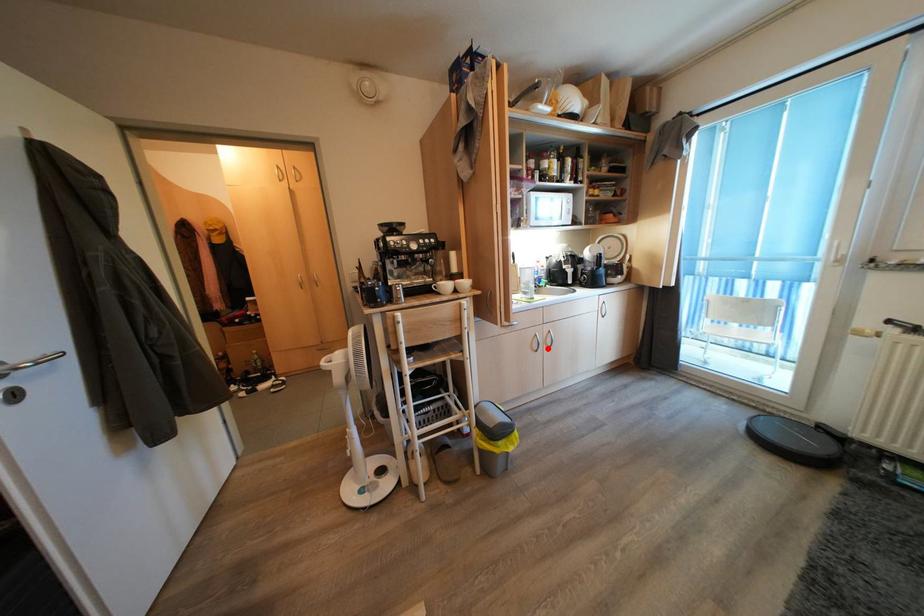
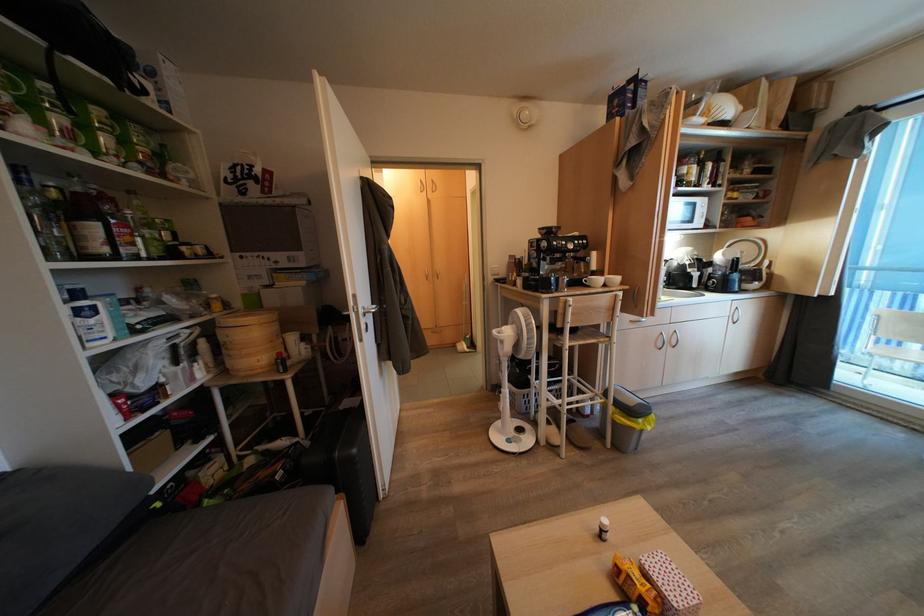
In the second image, find the point that corresponds to the highlighted location in the first image.

(672, 347)